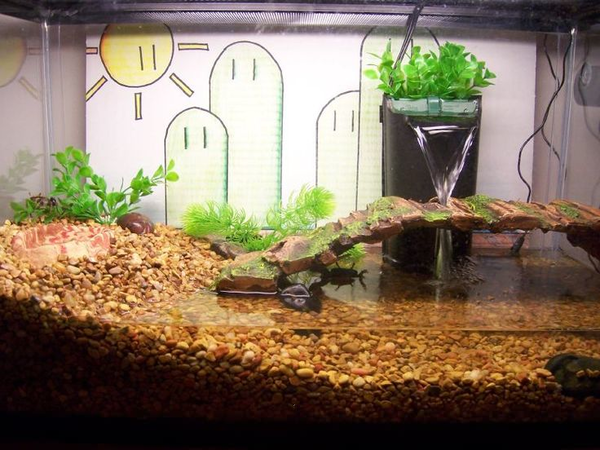
At what (x,y) coordinates should I click in order to perform the action: click on faux bridge inside aquarium. Please return your answer as a coordinate pair (x, y). This screenshot has height=450, width=600. Looking at the image, I should click on coord(459,217).